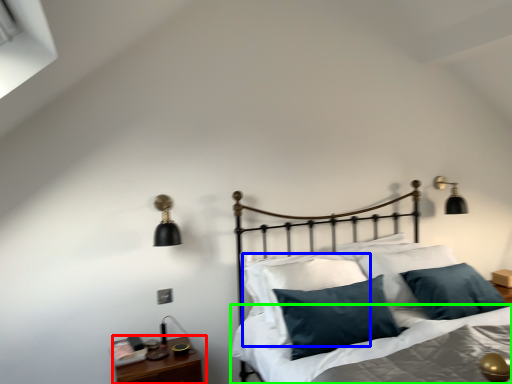
Question: Which object is the closest to the nightstand (highlighted by a red box)? Choose among these: pillow (highlighted by a blue box) or sheet (highlighted by a green box).

Choices:
 (A) pillow
 (B) sheet

Answer: (B)